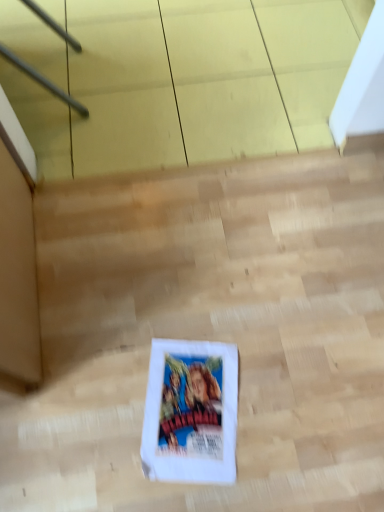
You are a GUI agent. You are given a task and a screenshot of the screen. Output one action in this format:
    pyautogui.click(x=<x>, y=<y>)
    Task: Click on the vacant location below white paper comic book at center (from a real-world perspective)
    Image resolution: width=384 pixels, height=512 pixels.
    Given the screenshot: What is the action you would take?
    pyautogui.click(x=194, y=407)